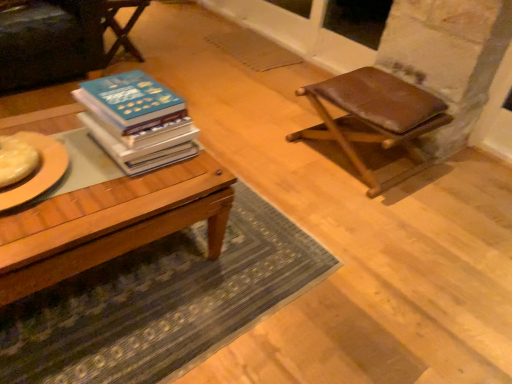
This screenshot has height=384, width=512. What are the coordinates of `vacant position to the left of hardcover books at center` in the screenshot? It's located at (53, 132).